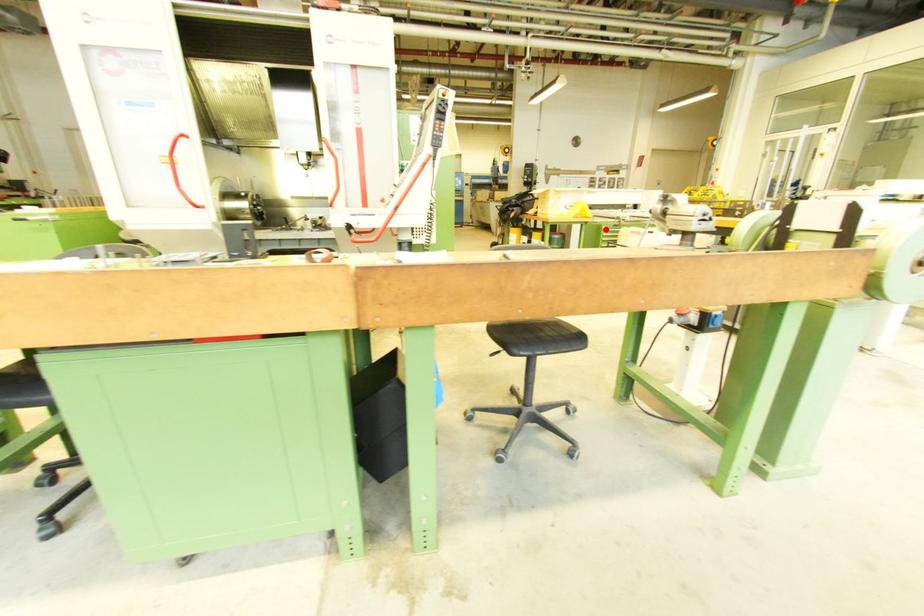
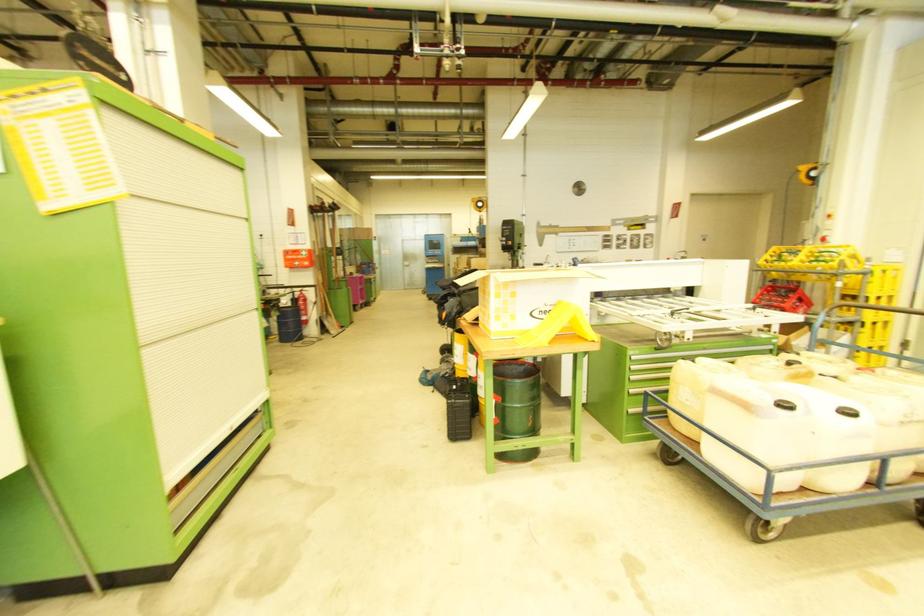
Question: I am providing you with two images of the same scene from different viewpoints. In image1, a red point is highlighted. Considering the same 3D point in image2, which of the following is correct?

Choices:
 (A) It is closer
 (B) It is farther

Answer: (B)